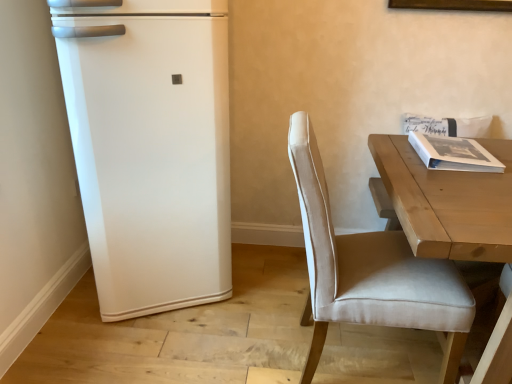
Locate an element on the screen. The height and width of the screenshot is (384, 512). vacant space to the left of beige fabric chair at right is located at coordinates (234, 339).